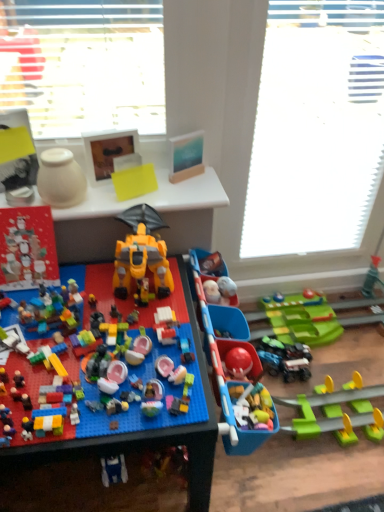
Locate an element on the screen. free space above yellow plastic table at upper center (from a real-world perspective) is located at coordinates (129, 189).